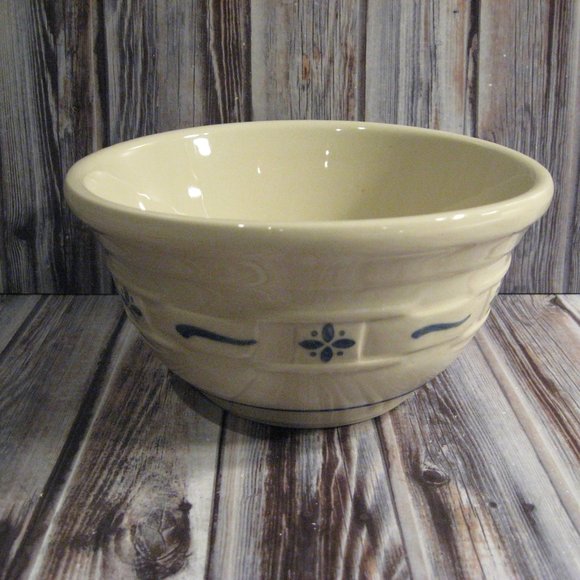
Image resolution: width=580 pixels, height=580 pixels. Find the location of `wooden surface`. wooden surface is located at coordinates (74, 427), (506, 449).